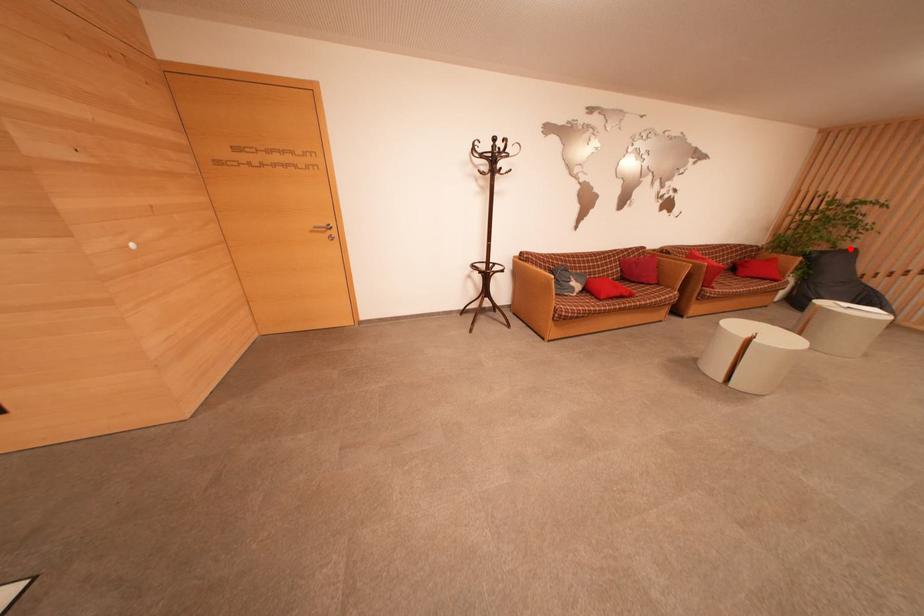
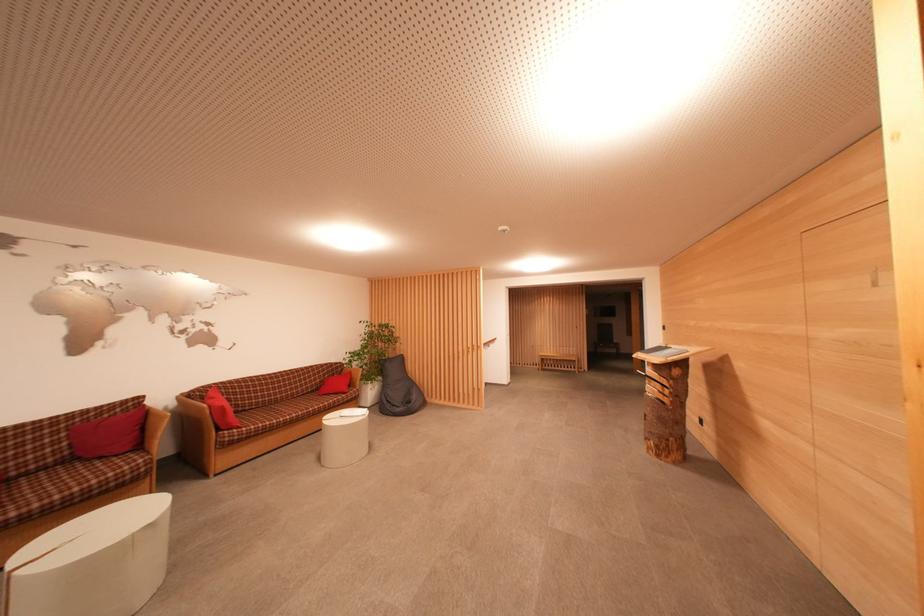
In the second image, find the point that corresponds to the highlighted location in the first image.

(402, 357)